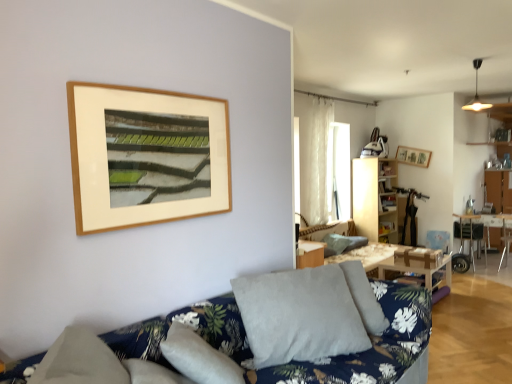
Question: Is gray fabric pillow at center, the first pillow viewed from the left, taller than metallic silver armchair at lower right?

Choices:
 (A) no
 (B) yes

Answer: (A)

Question: Is gray fabric pillow at center, the second pillow viewed from the back, wider than metallic silver armchair at lower right?

Choices:
 (A) no
 (B) yes

Answer: (A)

Question: Can you confirm if gray fabric pillow at center, the first pillow viewed from the left, is smaller than metallic silver armchair at lower right?

Choices:
 (A) yes
 (B) no

Answer: (B)

Question: Are gray fabric pillow at center, placed as the second pillow when sorted from right to left, and metallic silver armchair at lower right beside each other?

Choices:
 (A) yes
 (B) no

Answer: (B)

Question: From the image's perspective, does gray fabric pillow at center, the second pillow viewed from the back, appear lower than metallic silver armchair at lower right?

Choices:
 (A) no
 (B) yes

Answer: (A)

Question: Is gray fabric pillow at center, the first pillow viewed from the left, thinner than metallic silver armchair at lower right?

Choices:
 (A) yes
 (B) no

Answer: (A)

Question: Does wooden picture frame at upper right have a greater width compared to wooden table at right, arranged as the first table when viewed from the right?

Choices:
 (A) no
 (B) yes

Answer: (A)

Question: Are wooden picture frame at upper right and wooden table at right, arranged as the first table when viewed from the right, far apart?

Choices:
 (A) yes
 (B) no

Answer: (A)

Question: Does wooden picture frame at upper right have a larger size compared to wooden table at right, placed as the 1th table when sorted from back to front?

Choices:
 (A) yes
 (B) no

Answer: (B)

Question: Is wooden table at right, placed as the 1th table when sorted from back to front, located within wooden picture frame at upper right?

Choices:
 (A) no
 (B) yes

Answer: (A)

Question: Considering the relative sizes of wooden picture frame at upper right and wooden table at right, placed as the 1th table when sorted from back to front, in the image provided, is wooden picture frame at upper right taller than wooden table at right, placed as the 1th table when sorted from back to front,?

Choices:
 (A) no
 (B) yes

Answer: (A)

Question: Is wooden picture frame at upper right further to camera compared to wooden table at right, arranged as the first table when viewed from the right?

Choices:
 (A) no
 (B) yes

Answer: (B)

Question: Is metallic silver chair at right looking in the opposite direction of wooden table at right, the 2th table viewed from the front?

Choices:
 (A) no
 (B) yes

Answer: (A)